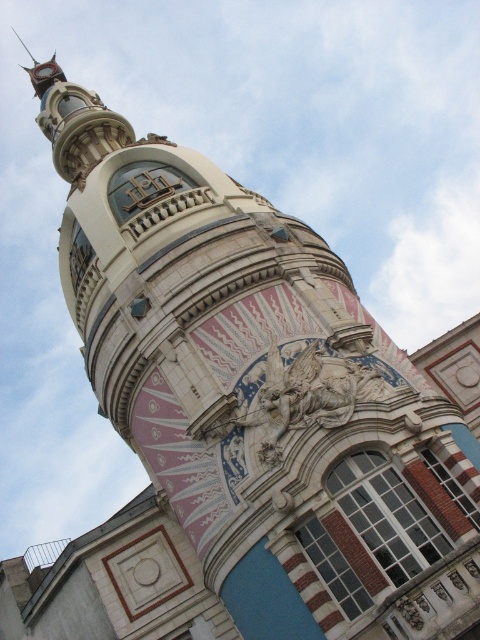
Can you confirm if carved stone sculpture at center is shorter than polished brass clock at upper left?

Correct, carved stone sculpture at center is not as tall as polished brass clock at upper left.

Describe the element at coordinates (302, 396) in the screenshot. I see `carved stone sculpture at center` at that location.

Who is more distant from viewer, (327, 416) or (47, 76)?

The point (47, 76) is more distant.

I want to click on carved stone sculpture at center, so click(x=302, y=396).